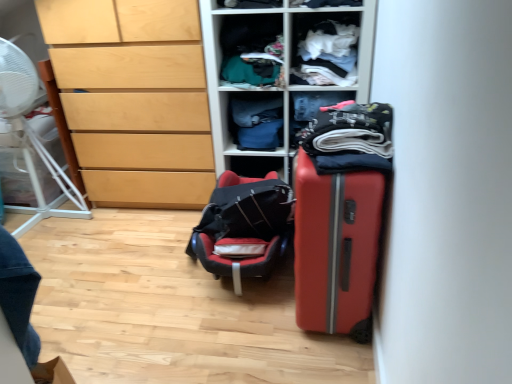
Question: Considering the positions of white plastic fan at left and matte orange suitcase at right in the image, is white plastic fan at left bigger or smaller than matte orange suitcase at right?

Choices:
 (A) big
 (B) small

Answer: (A)

Question: Would you say white plastic fan at left is inside or outside matte orange suitcase at right?

Choices:
 (A) outside
 (B) inside

Answer: (A)

Question: Which object is the farthest from the matte orange suitcase at right?

Choices:
 (A) white plastic fan at left
 (B) black fabric backpack at center
 (C) light wood chest of drawers at left
 (D) textured green fabric at upper center, arranged as the 3th clothing when viewed from the front
 (E) denim fabric pants at center, positioned as the first clothing in back-to-front order

Answer: (A)

Question: Considering the real-world distances, which object is farthest from the white cotton shirt at upper center, which ranks as the 4th clothing in back-to-front order?

Choices:
 (A) black fabric backpack at center
 (B) matte orange suitcase at right
 (C) light wood chest of drawers at left
 (D) textured green fabric at upper center, acting as the 3th clothing starting from the back
 (E) matte plastic shelving unit at center

Answer: (B)